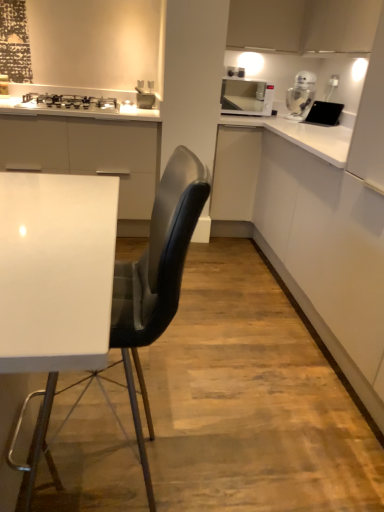
You are a GUI agent. You are given a task and a screenshot of the screen. Output one action in this format:
    pyautogui.click(x=<x>, y=<y>)
    Task: Click on the free space behind black leather chair at center
    
    Given the screenshot: What is the action you would take?
    pyautogui.click(x=152, y=396)